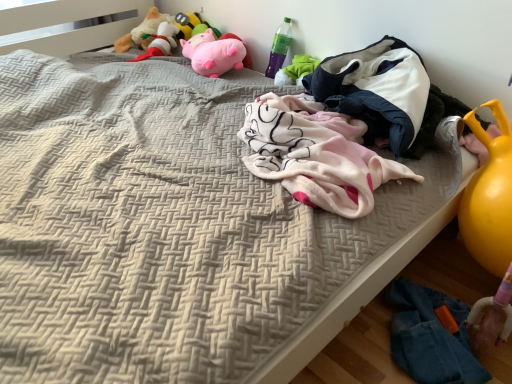
Question: Is the depth of green plastic bottle at upper right less than that of pink plush pig at upper center, which is counted as the 4th toy, starting from the left?

Choices:
 (A) no
 (B) yes

Answer: (B)

Question: Can you confirm if green plastic bottle at upper right is smaller than pink plush pig at upper center, which is counted as the 4th toy, starting from the left?

Choices:
 (A) yes
 (B) no

Answer: (A)

Question: Does green plastic bottle at upper right come behind pink plush pig at upper center, the first toy in the right-to-left sequence?

Choices:
 (A) yes
 (B) no

Answer: (B)

Question: Is green plastic bottle at upper right with pink plush pig at upper center, which is counted as the 4th toy, starting from the left?

Choices:
 (A) no
 (B) yes

Answer: (A)

Question: Considering the relative sizes of green plastic bottle at upper right and pink plush pig at upper center, which is counted as the 4th toy, starting from the left, in the image provided, is green plastic bottle at upper right taller than pink plush pig at upper center, which is counted as the 4th toy, starting from the left,?

Choices:
 (A) no
 (B) yes

Answer: (B)

Question: Does green plastic bottle at upper right have a lesser height compared to pink plush pig at upper center, the first toy in the right-to-left sequence?

Choices:
 (A) yes
 (B) no

Answer: (B)

Question: From the image's perspective, is pink plush toy at upper center, the third toy from the left, on fluffy plush toy at upper left, positioned as the 3th toy in right-to-left order?

Choices:
 (A) yes
 (B) no

Answer: (A)

Question: Is pink plush toy at upper center, the third toy from the left, not near fluffy plush toy at upper left, positioned as the 3th toy in right-to-left order?

Choices:
 (A) no
 (B) yes

Answer: (A)

Question: From the image's perspective, is pink plush toy at upper center, the third toy from the left, located beneath fluffy plush toy at upper left, marked as the 2th toy in a left-to-right arrangement?

Choices:
 (A) yes
 (B) no

Answer: (B)

Question: Is fluffy plush toy at upper left, marked as the 2th toy in a left-to-right arrangement, located within pink plush toy at upper center, the second toy from the right?

Choices:
 (A) yes
 (B) no

Answer: (B)

Question: Does pink plush toy at upper center, the third toy from the left, have a greater height compared to fluffy plush toy at upper left, positioned as the 3th toy in right-to-left order?

Choices:
 (A) yes
 (B) no

Answer: (B)

Question: Considering the relative sizes of pink plush toy at upper center, the second toy from the right, and fluffy plush toy at upper left, positioned as the 3th toy in right-to-left order, in the image provided, is pink plush toy at upper center, the second toy from the right, wider than fluffy plush toy at upper left, positioned as the 3th toy in right-to-left order,?

Choices:
 (A) yes
 (B) no

Answer: (B)

Question: Considering the relative positions of fluffy beige stuffed animal at upper left, placed as the 1th toy when sorted from left to right, and pink plush toy at upper center, the second toy from the right, in the image provided, is fluffy beige stuffed animal at upper left, placed as the 1th toy when sorted from left to right, to the right of pink plush toy at upper center, the second toy from the right, from the viewer's perspective?

Choices:
 (A) yes
 (B) no

Answer: (B)